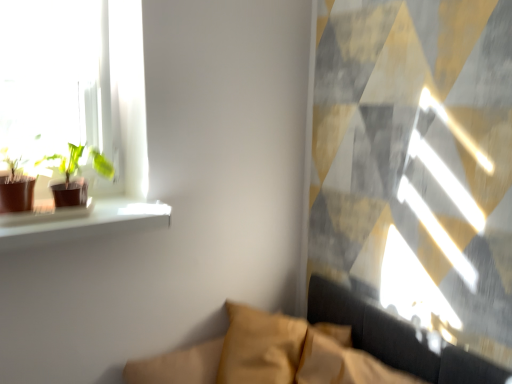
Question: Is velvet mustard couch at lower center wider than matte brown pot at left, the 1th houseplant in the left-to-right sequence?

Choices:
 (A) no
 (B) yes

Answer: (B)

Question: Is velvet mustard couch at lower center smaller than matte brown pot at left, which is the 2th houseplant from right to left?

Choices:
 (A) no
 (B) yes

Answer: (A)

Question: Would you say matte brown pot at left, the 1th houseplant in the left-to-right sequence, is part of velvet mustard couch at lower center's contents?

Choices:
 (A) yes
 (B) no

Answer: (B)

Question: From the image's perspective, does velvet mustard couch at lower center appear lower than matte brown pot at left, the 1th houseplant in the left-to-right sequence?

Choices:
 (A) yes
 (B) no

Answer: (A)

Question: Is velvet mustard couch at lower center further to the viewer compared to matte brown pot at left, the 1th houseplant in the left-to-right sequence?

Choices:
 (A) no
 (B) yes

Answer: (A)

Question: From a real-world perspective, is velvet mustard couch at lower center under matte brown pot at left, the 1th houseplant in the left-to-right sequence?

Choices:
 (A) yes
 (B) no

Answer: (A)

Question: Does matte brown pot at left, which is the 2th houseplant from right to left, have a smaller size compared to green matte plant at left, the 1th houseplant viewed from the right?

Choices:
 (A) yes
 (B) no

Answer: (A)

Question: Is matte brown pot at left, which is the 2th houseplant from right to left, looking in the opposite direction of green matte plant at left, the 2th houseplant from the left?

Choices:
 (A) yes
 (B) no

Answer: (B)

Question: From a real-world perspective, is matte brown pot at left, which is the 2th houseplant from right to left, over green matte plant at left, the 2th houseplant from the left?

Choices:
 (A) no
 (B) yes

Answer: (B)

Question: Is matte brown pot at left, which is the 2th houseplant from right to left, not within green matte plant at left, the 2th houseplant from the left?

Choices:
 (A) no
 (B) yes

Answer: (B)

Question: Is green matte plant at left, the 1th houseplant viewed from the right, completely or partially inside matte brown pot at left, which is the 2th houseplant from right to left?

Choices:
 (A) no
 (B) yes

Answer: (A)

Question: Is matte brown pot at left, which is the 2th houseplant from right to left, to the left of green matte plant at left, the 1th houseplant viewed from the right, from the viewer's perspective?

Choices:
 (A) yes
 (B) no

Answer: (A)

Question: Considering the relative sizes of matte brown pot at left, the 1th houseplant in the left-to-right sequence, and velvet mustard couch at lower center in the image provided, is matte brown pot at left, the 1th houseplant in the left-to-right sequence, taller than velvet mustard couch at lower center?

Choices:
 (A) yes
 (B) no

Answer: (B)